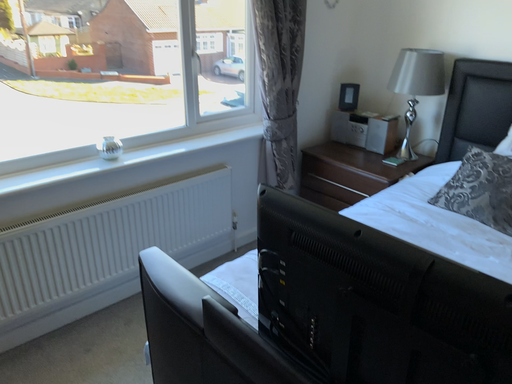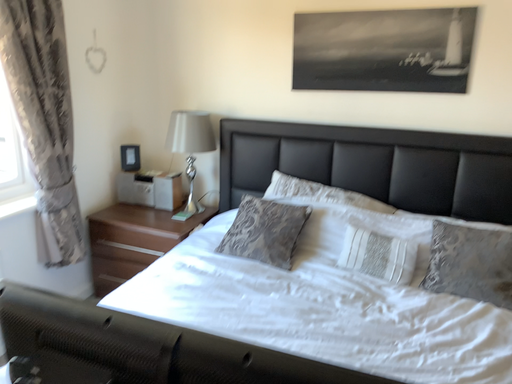
Question: How did the camera likely rotate when shooting the video?

Choices:
 (A) rotated left
 (B) rotated right

Answer: (B)